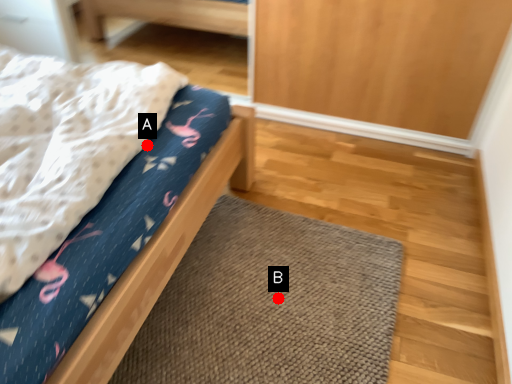
Question: Two points are circled on the image, labeled by A and B beside each circle. Which point is farther to the camera?

Choices:
 (A) A is further
 (B) B is further

Answer: (B)